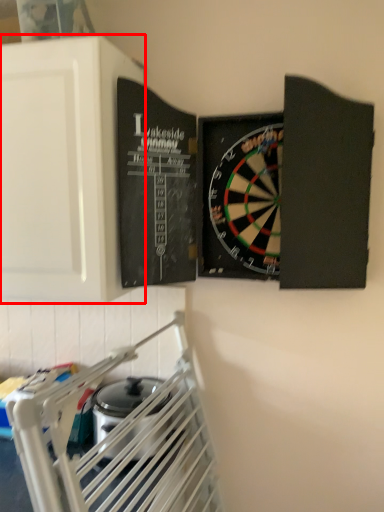
Question: Where is cabinetry (annotated by the red box) located in relation to appliance in the image?

Choices:
 (A) right
 (B) left

Answer: (B)